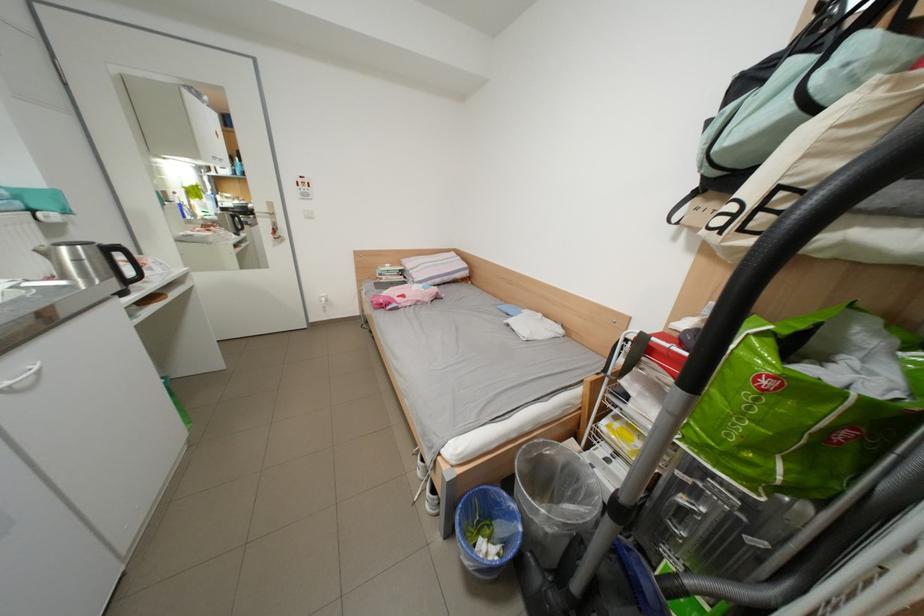
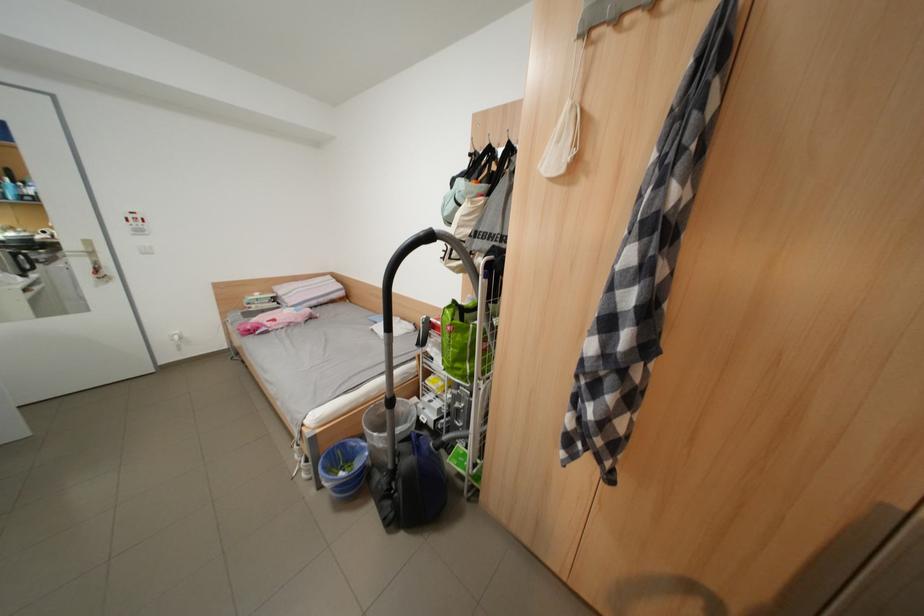
Locate, in the second image, the point that corresponds to point 393,302 in the first image.

(261, 329)